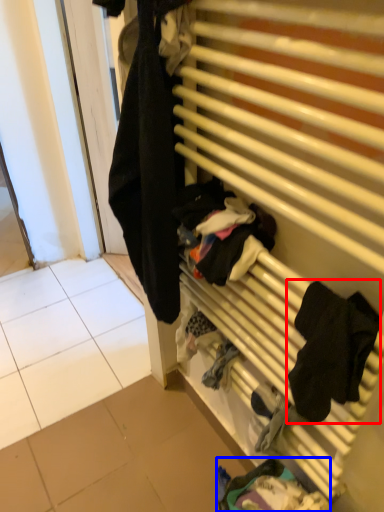
Question: Among these objects, which one is nearest to the camera, clothing (highlighted by a red box) or clothing (highlighted by a blue box)?

Choices:
 (A) clothing
 (B) clothing

Answer: (A)